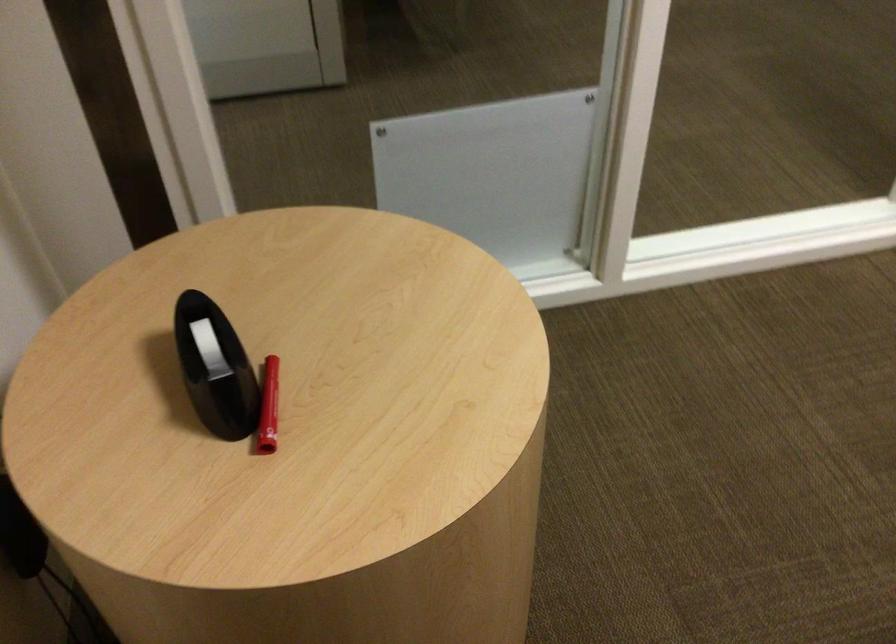
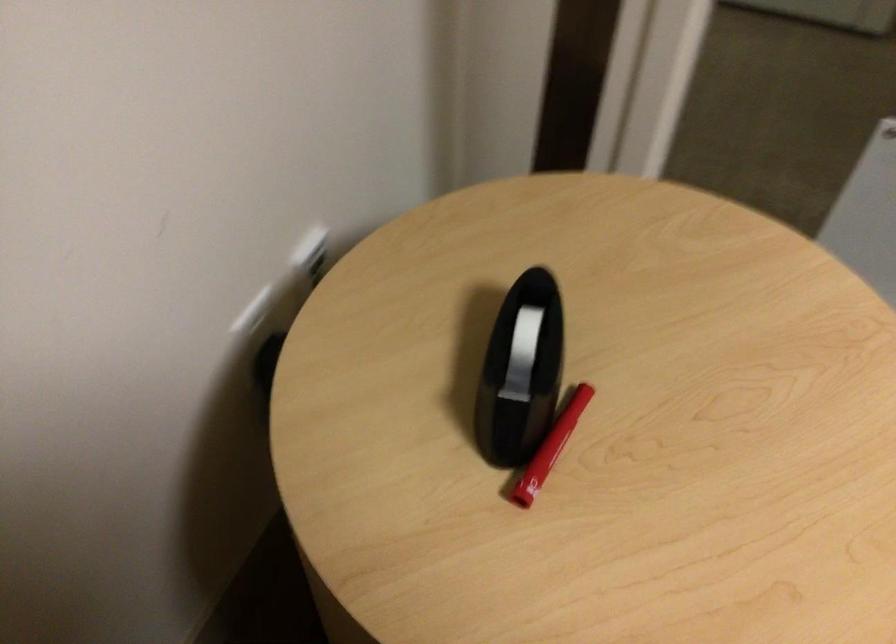
In the second image, find the point that corresponds to the point at 271,404 in the first image.

(557, 438)